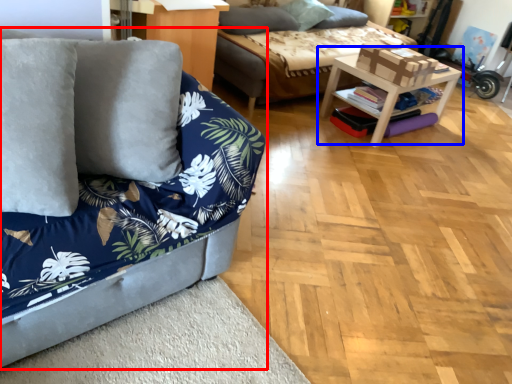
Question: Which of the following is the farthest to the observer, studio couch (highlighted by a red box) or table (highlighted by a blue box)?

Choices:
 (A) studio couch
 (B) table

Answer: (B)